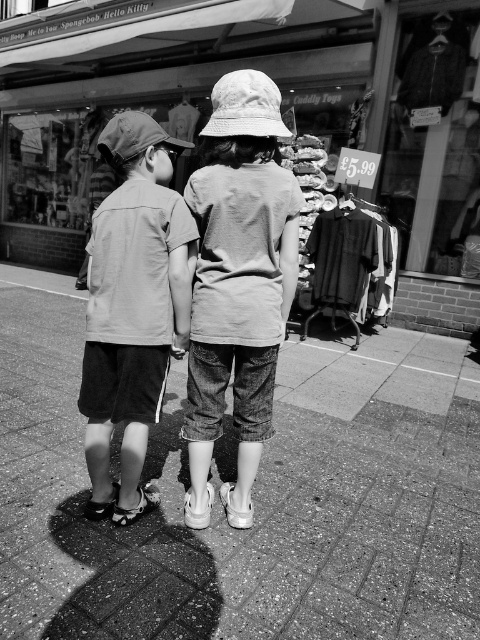
Which of these two, textured fabric shirts at center or white cotton shirt at center, stands shorter?

Standing shorter between the two is white cotton shirt at center.

Does point (469, 3) come closer to viewer compared to point (220, 300)?

No, (469, 3) is further to viewer.

This screenshot has width=480, height=640. Find the location of `textured fabric shirts at center`. textured fabric shirts at center is located at coordinates (285, 108).

Who is lower down, textured fabric shirts at center or white fabric sandal at lower center?

white fabric sandal at lower center is lower down.

Describe the element at coordinates (285, 108) in the screenshot. The height and width of the screenshot is (640, 480). I see `textured fabric shirts at center` at that location.

Image resolution: width=480 pixels, height=640 pixels. I want to click on textured fabric shirts at center, so click(x=285, y=108).

Is white cotton shirt at center wider than white fabric sandal at lower center?

Correct, the width of white cotton shirt at center exceeds that of white fabric sandal at lower center.

Does white cotton shirt at center appear under white fabric sandal at lower center?

Incorrect, white cotton shirt at center is not positioned below white fabric sandal at lower center.

Locate an element on the screen. white cotton shirt at center is located at coordinates (238, 280).